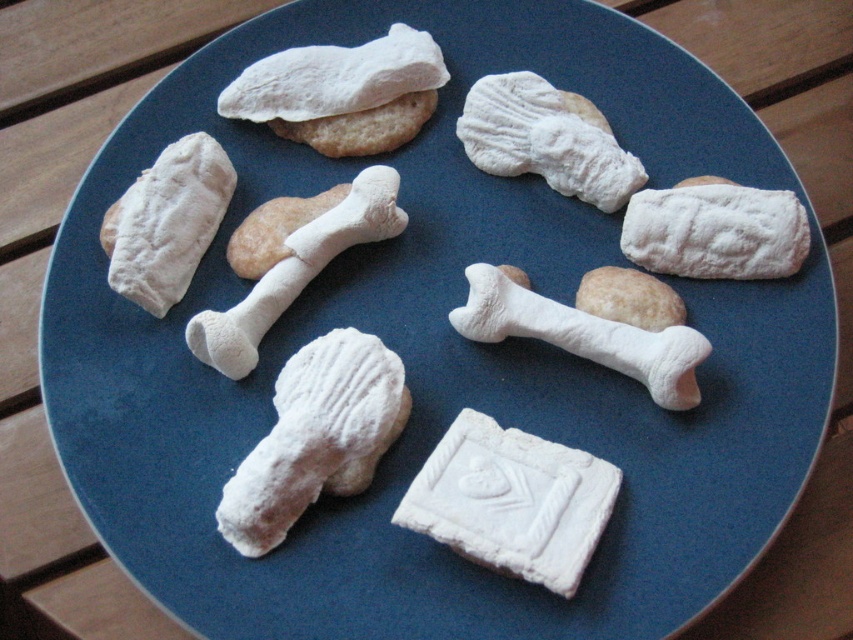
Question: Can you confirm if powdered white bone at upper center is wider than white matte bone at center?

Choices:
 (A) yes
 (B) no

Answer: (B)

Question: Which object appears closest to the camera in this image?

Choices:
 (A) powdered white bone at upper right
 (B) powdered white bone at center

Answer: (B)

Question: Is powdered white bone at center closer to camera compared to powdered white bone at upper left?

Choices:
 (A) yes
 (B) no

Answer: (A)

Question: Is powdered white bone at upper right further to camera compared to powdered white bone at upper center?

Choices:
 (A) yes
 (B) no

Answer: (B)

Question: Which point appears closest to the camera in this image?

Choices:
 (A) (339, 451)
 (B) (677, 189)
 (C) (251, 308)
 (D) (512, 316)

Answer: (A)

Question: Which point is farther from the camera taking this photo?

Choices:
 (A) (311, 362)
 (B) (560, 310)
 (C) (463, 138)

Answer: (C)